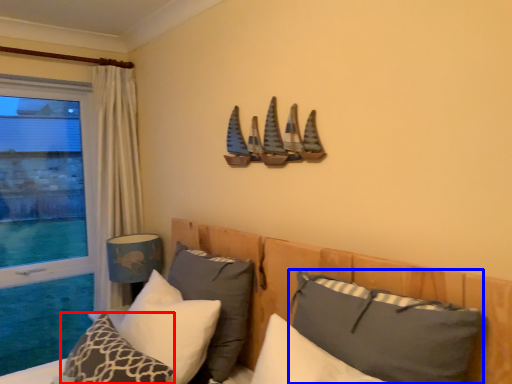
Question: Which point is further to the camera, pillow (highlighted by a red box) or pillow (highlighted by a blue box)?

Choices:
 (A) pillow
 (B) pillow

Answer: (A)